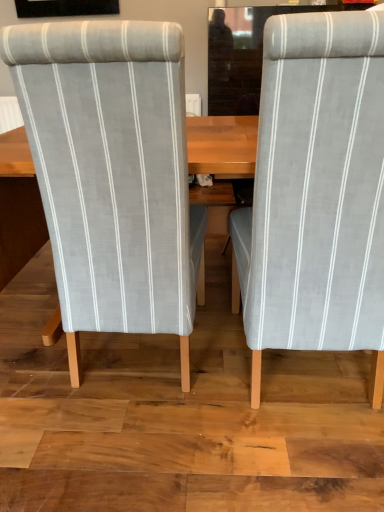
At what (x,y) coordinates should I click in order to perform the action: click on blank area beneath light gray striped fabric chair at left, the second chair from the right (from a real-world perspective). Please return your answer as a coordinate pair (x, y). Looking at the image, I should click on [x=132, y=364].